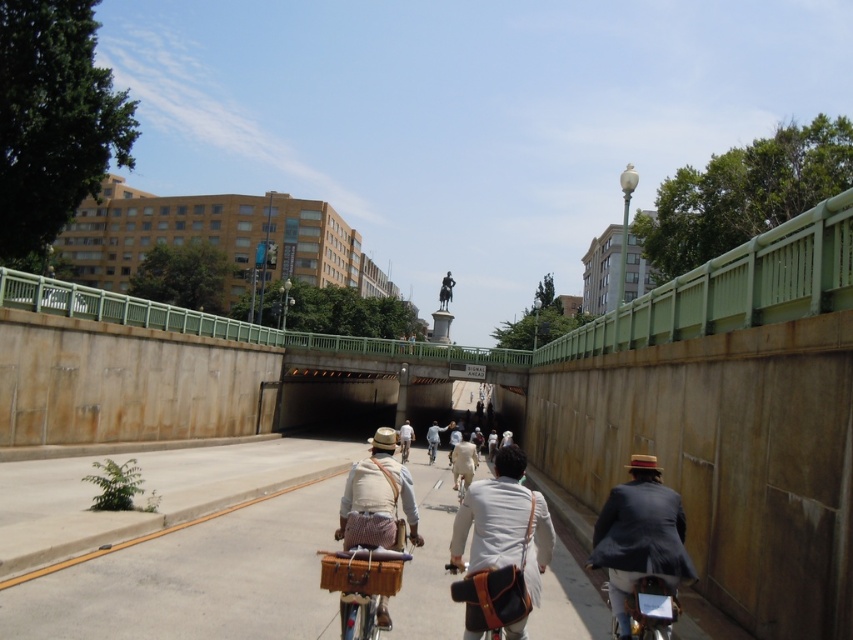
Question: Does white leather jacket at center come behind white cotton shirt at center?

Choices:
 (A) yes
 (B) no

Answer: (B)

Question: Is dark blue suit at right above light brown leather jacket at center?

Choices:
 (A) yes
 (B) no

Answer: (A)

Question: Among these points, which one is farthest from the camera?

Choices:
 (A) (428, 436)
 (B) (126, 618)
 (C) (665, 564)
 (D) (434, 451)

Answer: (D)

Question: Which is nearer to the smooth concrete bike lane at center?

Choices:
 (A) dark blue suit at right
 (B) light brown leather jacket at center

Answer: (A)

Question: Is smooth concrete bike lane at center above light brown leather jacket at center?

Choices:
 (A) no
 (B) yes

Answer: (B)

Question: Which of the following is the closest to the observer?

Choices:
 (A) white leather jacket at center
 (B) brown leather basket at center
 (C) white cotton shirt at center
 (D) metallic silver bicycle at center

Answer: (A)